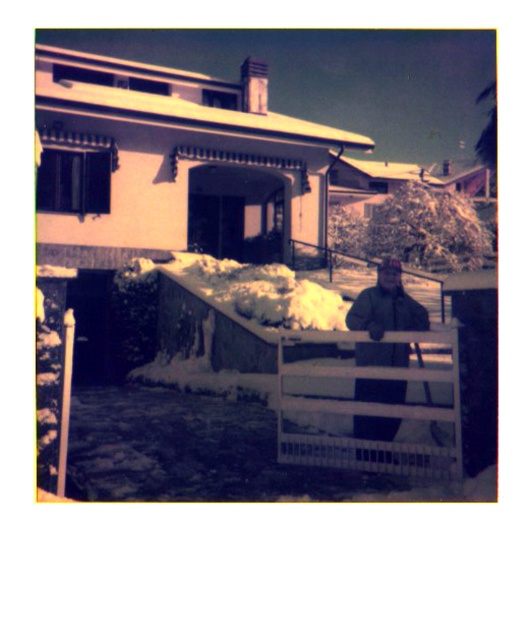
Question: Can you confirm if white matte fence at center is positioned to the right of green matte jacket at center?

Choices:
 (A) no
 (B) yes

Answer: (A)

Question: Does white matte fence at center have a larger size compared to green matte jacket at center?

Choices:
 (A) no
 (B) yes

Answer: (B)

Question: Which point is closer to the camera taking this photo?

Choices:
 (A) (379, 316)
 (B) (373, 401)

Answer: (A)

Question: Which point is closer to the camera taking this photo?

Choices:
 (A) (376, 433)
 (B) (455, 364)

Answer: (B)

Question: Among these points, which one is nearest to the camera?

Choices:
 (A) (x=314, y=403)
 (B) (x=387, y=342)

Answer: (A)

Question: Does white matte fence at center appear under green matte jacket at center?

Choices:
 (A) no
 (B) yes

Answer: (B)